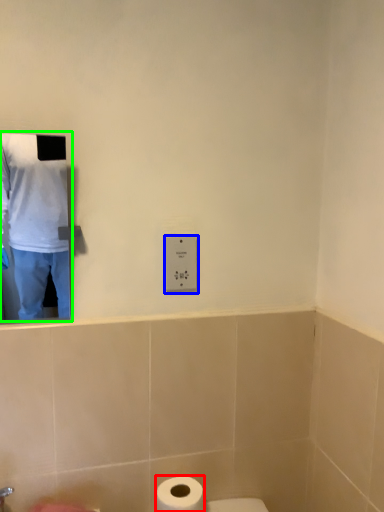
Question: Based on their relative distances, which object is nearer to toilet paper (highlighted by a red box)? Choose from electric outlet (highlighted by a blue box) and man (highlighted by a green box).

Choices:
 (A) electric outlet
 (B) man

Answer: (A)